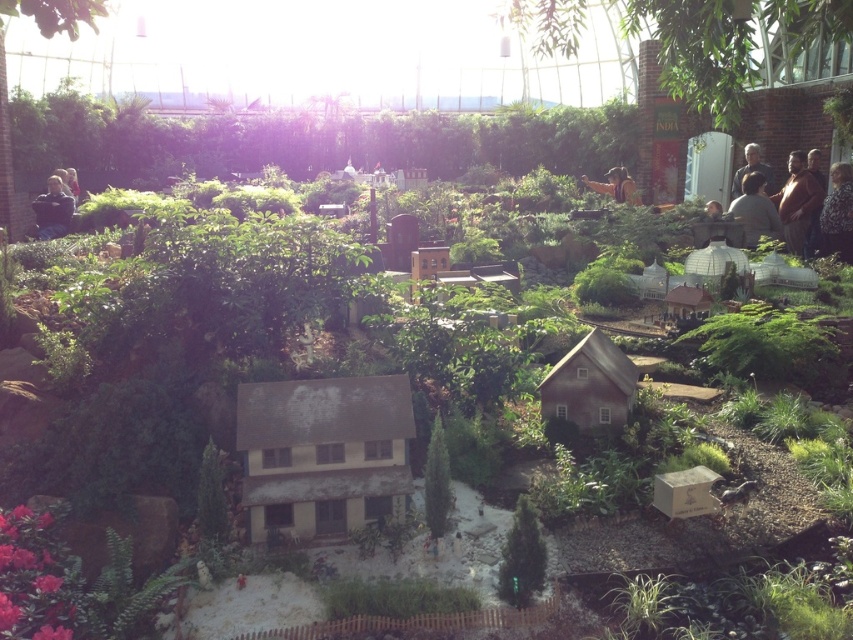
You are a photographer planning to take a portrait of the person in the dark blue shirt at left and gray hair at upper right. Based on their height difference, which part of the scene should you position them so that both are fully visible in the frame?

The dark blue shirt at left is much taller than the gray hair at upper right. To ensure both are fully visible, position the person so the taller dark blue shirt at left is in the foreground and the shorter gray hair at upper right is slightly behind, allowing their full height to be captured without cropping.

You are a drone operator trying to capture a photo of the greenhouse diorama. You need to ensure both the point at (48, 211) and the point at (770, 180) are in focus. Which point should you focus on to ensure both are sharp?

You should focus on point (770, 180) because it is farther from the camera, and focusing on the farther point will keep both points in focus due to the depth of field extending backward and forward from that point.